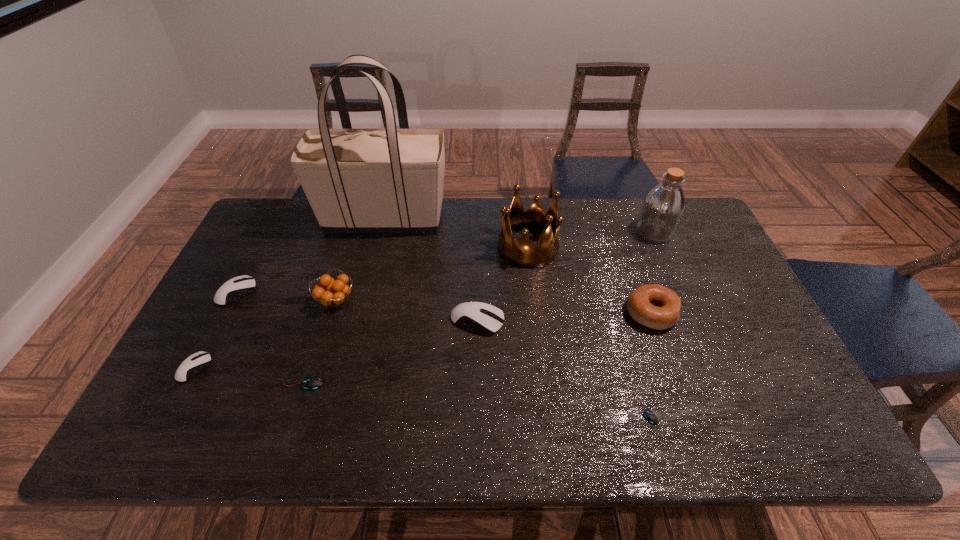
This screenshot has width=960, height=540. I want to click on object that is at the near edge, so click(650, 416).

This screenshot has width=960, height=540. What are the coordinates of `object that is at the right edge` in the screenshot? It's located at (663, 207).

Where is `object that is positioned at the far right corner`? The width and height of the screenshot is (960, 540). object that is positioned at the far right corner is located at coordinates (663, 207).

In the image, there is a desktop. Where is `vacant space at the far edge`? This screenshot has height=540, width=960. vacant space at the far edge is located at coordinates (607, 222).

This screenshot has height=540, width=960. What are the coordinates of `vacant area at the near edge of the desktop` in the screenshot? It's located at (539, 448).

Find the location of `vacant area at the left edge`. vacant area at the left edge is located at coordinates (256, 275).

You are a GUI agent. You are given a task and a screenshot of the screen. Output one action in this format:
    pyautogui.click(x=<x>, y=<y>)
    Task: Click on the blank space at the right edge of the desktop
    The width and height of the screenshot is (960, 540).
    Given the screenshot: What is the action you would take?
    pyautogui.click(x=728, y=278)

Find the location of a particular element. free space at the far right corner is located at coordinates (699, 223).

The width and height of the screenshot is (960, 540). Find the location of `free space between the sixth shortest object and the farthest white mouse`. free space between the sixth shortest object and the farthest white mouse is located at coordinates (444, 303).

You are a GUI agent. You are given a task and a screenshot of the screen. Output one action in this format:
    pyautogui.click(x=<x>, y=<y>)
    Task: Click on the blank region between the fifth tallest object and the bigger black mouse
    The image size is (960, 540).
    Given the screenshot: What is the action you would take?
    pyautogui.click(x=475, y=349)